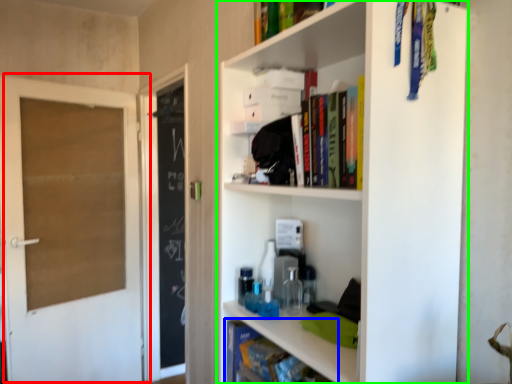
Question: Which object is positioned closest to door (highlighted by a red box)? Select from book (highlighted by a blue box) and shelf (highlighted by a green box).

Choices:
 (A) book
 (B) shelf

Answer: (A)